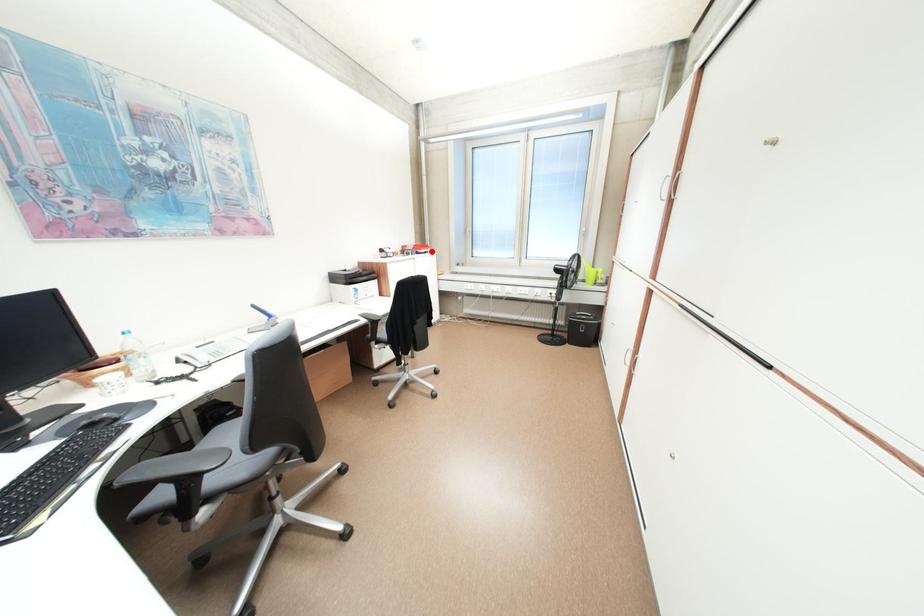
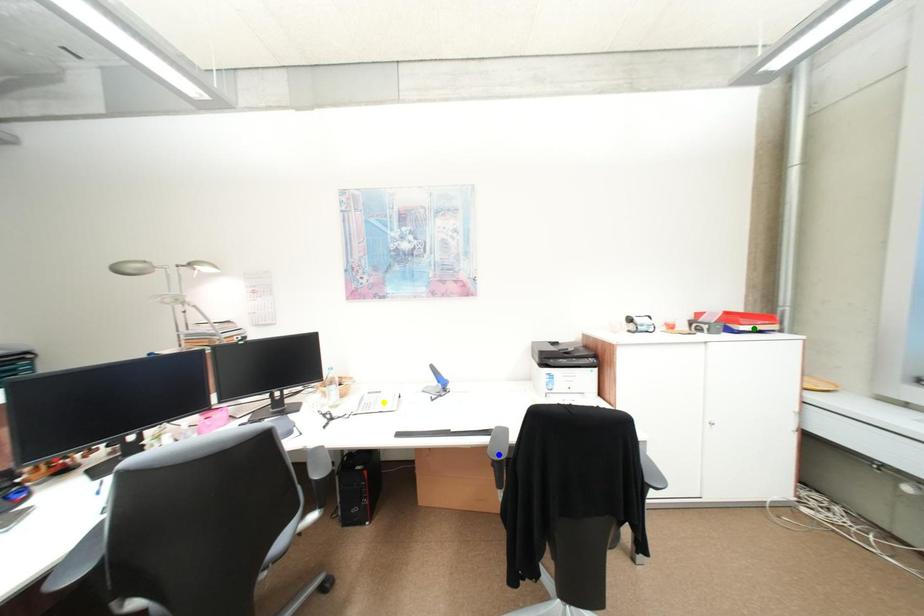
Question: I am providing you with two images of the same scene from different viewpoints. A red point is marked on the first image. You are given multiple points on the second image. Which point in image 2 represents the same 3d spot as the red point in image 1?

Choices:
 (A) blue point
 (B) green point
 (C) yellow point

Answer: (B)